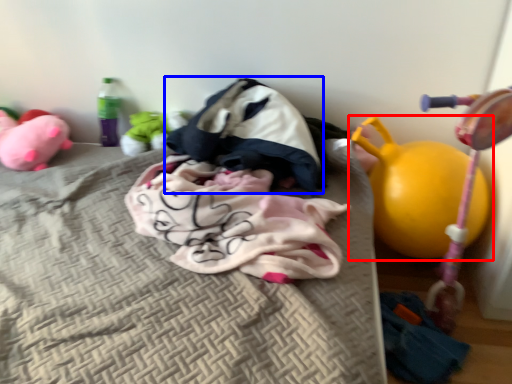
Question: Which of the following is the farthest to the observer, toy (highlighted by a red box) or sleeping bag (highlighted by a blue box)?

Choices:
 (A) toy
 (B) sleeping bag

Answer: (B)